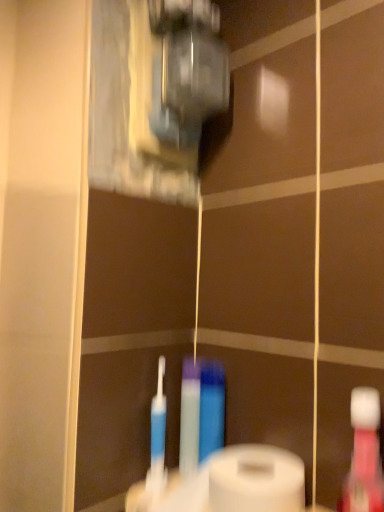
Question: Should I look upward or downward to see translucent plastic mouthwash at right?

Choices:
 (A) up
 (B) down

Answer: (B)

Question: Does translucent plastic mouthwash at right have a larger size compared to white matte toilet paper at lower center?

Choices:
 (A) yes
 (B) no

Answer: (B)

Question: Does translucent plastic mouthwash at right appear on the right side of white matte toilet paper at lower center?

Choices:
 (A) yes
 (B) no

Answer: (A)

Question: Is translucent plastic mouthwash at right directly adjacent to white matte toilet paper at lower center?

Choices:
 (A) no
 (B) yes

Answer: (A)

Question: Does translucent plastic mouthwash at right have a smaller size compared to white matte toilet paper at lower center?

Choices:
 (A) no
 (B) yes

Answer: (B)

Question: Is translucent plastic mouthwash at right further to camera compared to white matte toilet paper at lower center?

Choices:
 (A) no
 (B) yes

Answer: (A)

Question: From a real-world perspective, does translucent plastic mouthwash at right sit lower than white matte toilet paper at lower center?

Choices:
 (A) yes
 (B) no

Answer: (B)

Question: Can you confirm if white matte toilet paper at lower center is wider than translucent plastic mouthwash at right?

Choices:
 (A) no
 (B) yes

Answer: (B)

Question: Is the position of white matte toilet paper at lower center less distant than that of translucent plastic mouthwash at right?

Choices:
 (A) no
 (B) yes

Answer: (A)

Question: Could you tell me if white matte toilet paper at lower center is turned towards translucent plastic mouthwash at right?

Choices:
 (A) no
 (B) yes

Answer: (A)

Question: Can you confirm if white matte toilet paper at lower center is positioned to the right of translucent plastic mouthwash at right?

Choices:
 (A) yes
 (B) no

Answer: (B)

Question: Does white matte toilet paper at lower center have a smaller size compared to translucent plastic mouthwash at right?

Choices:
 (A) yes
 (B) no

Answer: (B)

Question: From a real-world perspective, is white matte toilet paper at lower center located beneath translucent plastic mouthwash at right?

Choices:
 (A) yes
 (B) no

Answer: (A)

Question: Is point (235, 486) positioned closer to the camera than point (349, 475)?

Choices:
 (A) farther
 (B) closer

Answer: (A)